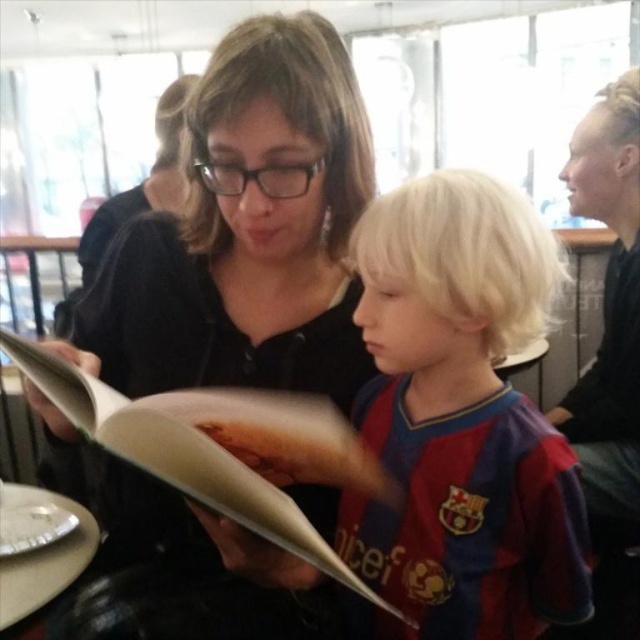
Question: Can you confirm if matte paper book at center is bigger than brown crumbly bread at center?

Choices:
 (A) no
 (B) yes

Answer: (B)

Question: Among these points, which one is farthest from the camera?

Choices:
 (A) (536, 300)
 (B) (8, 608)
 (C) (353, 580)
 (D) (99, 289)

Answer: (D)

Question: Is red striped jersey at center thinner than metallic silver plate at lower left?

Choices:
 (A) no
 (B) yes

Answer: (A)

Question: Which object is positioned closest to the matte paper book at center?

Choices:
 (A) red striped jersey at center
 (B) metallic silver plate at lower left

Answer: (A)

Question: Estimate the real-world distances between objects in this image. Which object is closer to the brown crumbly bread at center?

Choices:
 (A) red striped jersey at center
 (B) metallic silver plate at lower left

Answer: (A)

Question: Is matte black shirt at center wider than red striped jersey at center?

Choices:
 (A) no
 (B) yes

Answer: (B)